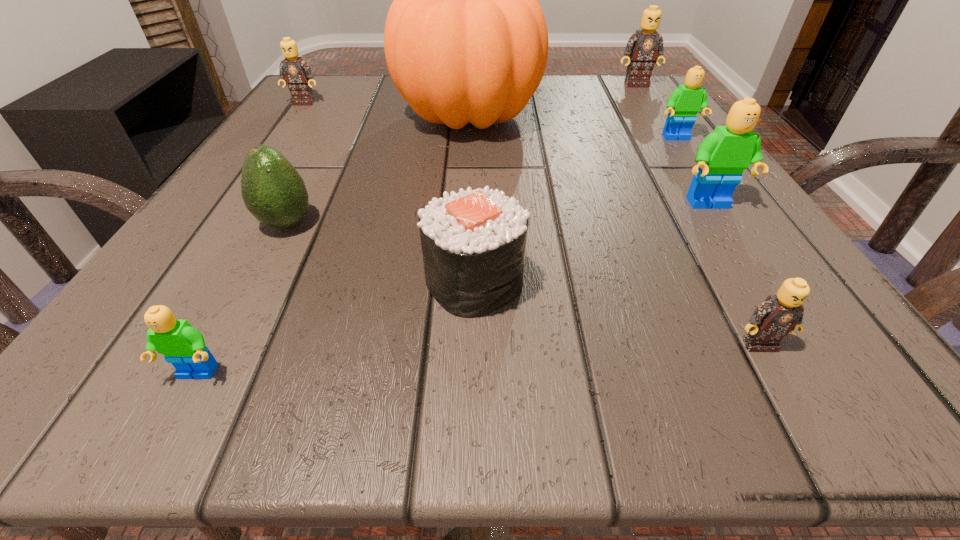
Identify the location of vacant area situated 0.350m on the face of the second smallest green Lego. (778, 287).

Where is `free space located 0.200m on the right of the avocado`? free space located 0.200m on the right of the avocado is located at coordinates (462, 224).

Identify the location of vacant space located on the back of the sushi. This screenshot has width=960, height=540. (476, 129).

Find the location of a particular element. pumpkin that is positioned at the far edge is located at coordinates (465, 39).

Find the location of a particular element. The width and height of the screenshot is (960, 540). avocado located in the left edge section of the desktop is located at coordinates (273, 191).

At what (x,y) coordinates should I click in order to perform the action: click on object present at the far left corner. Please return your answer as a coordinate pair (x, y). The width and height of the screenshot is (960, 540). Looking at the image, I should click on (297, 73).

Where is `object present at the near left corner`? This screenshot has height=540, width=960. object present at the near left corner is located at coordinates (183, 346).

You are a GUI agent. You are given a task and a screenshot of the screen. Output one action in this format:
    pyautogui.click(x=<x>, y=<y>)
    Task: Click on the object located at the far right corner
    The height and width of the screenshot is (540, 960).
    Given the screenshot: What is the action you would take?
    pyautogui.click(x=643, y=47)

This screenshot has height=540, width=960. Find the location of `object present at the near right corner`. object present at the near right corner is located at coordinates click(x=778, y=315).

I want to click on free space at the far edge of the desktop, so click(380, 115).